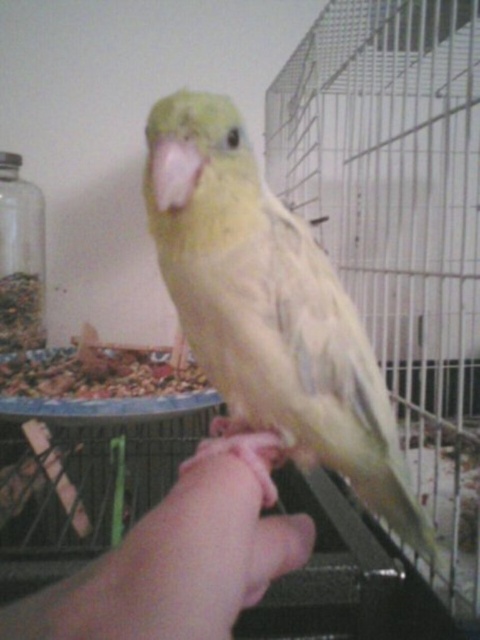
Question: Does yellow matte parrot at center have a lesser width compared to pink fabric hand at center?

Choices:
 (A) yes
 (B) no

Answer: (B)

Question: Which object is closer to the camera taking this photo?

Choices:
 (A) pink fabric hand at center
 (B) yellow matte parrot at center

Answer: (A)

Question: Is yellow matte parrot at center to the left of pink fabric hand at center from the viewer's perspective?

Choices:
 (A) no
 (B) yes

Answer: (A)

Question: From the image, what is the correct spatial relationship of yellow matte parrot at center in relation to pink fabric hand at center?

Choices:
 (A) left
 (B) right

Answer: (B)